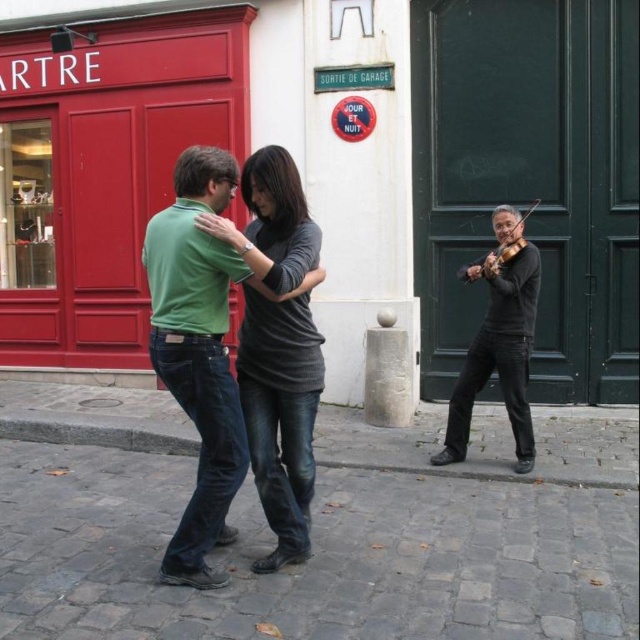
Question: Is matte red door at left wider than black matte violin at right?

Choices:
 (A) yes
 (B) no

Answer: (A)

Question: Can you confirm if gray cobblestone pavement at lower center is positioned to the right of green matte shirt at center?

Choices:
 (A) no
 (B) yes

Answer: (B)

Question: Estimate the real-world distances between objects in this image. Which object is closer to the black matte violin at right?

Choices:
 (A) green matte shirt at center
 (B) wooden violin at right
 (C) dark gray sweater at center
 (D) matte red door at left

Answer: (B)

Question: Which point is closer to the camera?

Choices:
 (A) (500, 208)
 (B) (611, 572)
 (C) (499, 282)

Answer: (B)

Question: Can you confirm if matte red door at left is positioned to the left of black matte violin at right?

Choices:
 (A) yes
 (B) no

Answer: (A)

Question: Considering the real-world distances, which object is closest to the black matte violin at right?

Choices:
 (A) dark gray sweater at center
 (B) gray cobblestone pavement at lower center
 (C) green matte shirt at center
 (D) matte red door at left

Answer: (B)